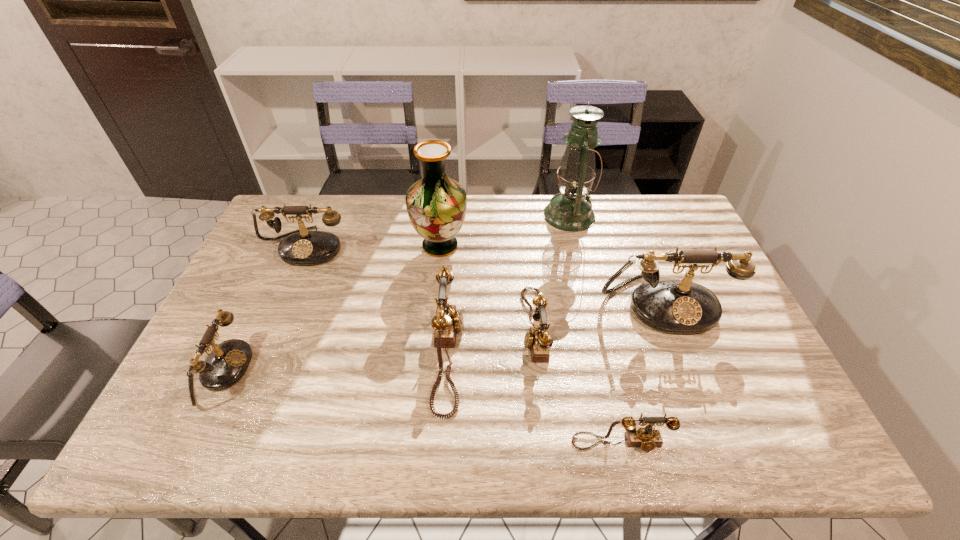
This screenshot has width=960, height=540. Find the location of `the smallest black telephone`. the smallest black telephone is located at coordinates (226, 364).

This screenshot has height=540, width=960. Find the location of `the nearest brown telephone`. the nearest brown telephone is located at coordinates (647, 438).

Where is `the nearest telephone`? the nearest telephone is located at coordinates coord(647,438).

You are a GUI agent. You are given a task and a screenshot of the screen. Output one action in this format:
    pyautogui.click(x=<x>, y=<y>)
    Task: Click on the vacant region located 0.280m on the left of the oil lamp
    The image size is (960, 540).
    Given the screenshot: What is the action you would take?
    pyautogui.click(x=463, y=215)

The image size is (960, 540). Identify the location of free space located on the back of the vase. (444, 197).

Where is `vacant space situated 0.180m on the dial of the third tallest object`? vacant space situated 0.180m on the dial of the third tallest object is located at coordinates (699, 397).

I want to click on free space located 0.170m on the dial of the farthest telephone, so click(280, 309).

Locate an element on the screen. The height and width of the screenshot is (540, 960). vacant space situated 0.100m on the front-facing side of the biggest brown telephone is located at coordinates (502, 354).

I want to click on vacant space situated 0.250m on the front-facing side of the second smallest brown telephone, so click(x=429, y=327).

The height and width of the screenshot is (540, 960). Find the location of `vacant region located 0.310m on the front-facing side of the second smallest brown telephone`. vacant region located 0.310m on the front-facing side of the second smallest brown telephone is located at coordinates (407, 327).